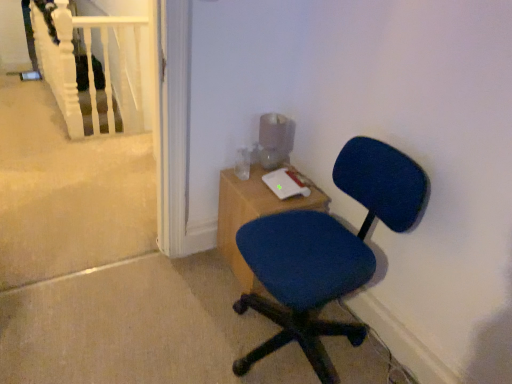
The image size is (512, 384). I want to click on vacant space underneath blue fabric chair at center (from a real-world perspective), so click(291, 342).